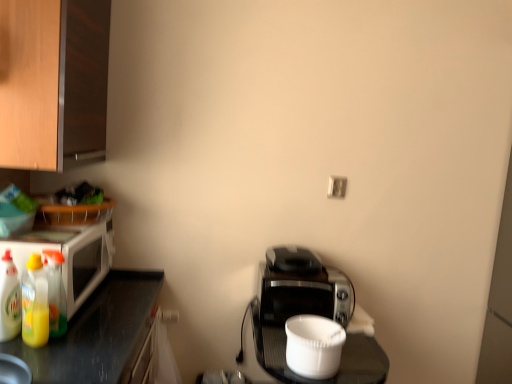
Measure the distance between white plastic container at center, acting as the 1th appliance starting from the front, and camera.

white plastic container at center, acting as the 1th appliance starting from the front, and camera are 1.40 meters apart.

What is the approximate height of black plastic toaster at center, the second appliance when ordered from front to back?

It is 8.12 inches.

In order to face wooden cabinet at upper left, should I rotate leftwards or rightwards?

You should look left and rotate roughly 26.152 degrees.

Where is `translucent plastic bottle at left, the third bottle from the right`? The width and height of the screenshot is (512, 384). translucent plastic bottle at left, the third bottle from the right is located at coordinates (x=9, y=298).

The height and width of the screenshot is (384, 512). Describe the element at coordinates (35, 303) in the screenshot. I see `yellow translucent bottle at left, which is the second bottle in left-to-right order` at that location.

Describe the element at coordinates (69, 255) in the screenshot. I see `white glossy microwave at left` at that location.

In order to click on white plastic container at center, which ranks as the 2th appliance in back-to-front order in this screenshot , I will do `click(314, 346)`.

From a real-world perspective, is translucent plastic bottle at left, the third bottle from the right, physically below white plastic electric outlet at upper center?

Yes, from a real-world perspective, translucent plastic bottle at left, the third bottle from the right, is beneath white plastic electric outlet at upper center.

You are a GUI agent. You are given a task and a screenshot of the screen. Output one action in this format:
    pyautogui.click(x=<x>, y=<y>)
    Task: Click on the 1st bottle below when counting from the white plastic electric outlet at upper center (from the image's perspective)
    
    Given the screenshot: What is the action you would take?
    pyautogui.click(x=9, y=298)

From the image's perspective, which one is positioned lower, translucent plastic bottle at left, the third bottle from the right, or white plastic electric outlet at upper center?

translucent plastic bottle at left, the third bottle from the right, is shown below in the image.

Between white glossy microwave at left and white plastic electric outlet at upper center, which one has smaller size?

With smaller size is white plastic electric outlet at upper center.

From the image's perspective, would you say white glossy microwave at left is shown under white plastic electric outlet at upper center?

Yes, from the image's perspective, white glossy microwave at left is below white plastic electric outlet at upper center.

Based on their positions, is white glossy microwave at left located to the left or right of white plastic electric outlet at upper center?

Based on their positions, white glossy microwave at left is located to the left of white plastic electric outlet at upper center.

Does white glossy microwave at left turn towards white plastic electric outlet at upper center?

Yes, white glossy microwave at left is aimed at white plastic electric outlet at upper center.

What's the angular difference between yellow translucent bottle at left, which is counted as the 2th bottle, starting from the right, and white plastic electric outlet at upper center's facing directions?

72.4 degrees separate the facing orientations of yellow translucent bottle at left, which is counted as the 2th bottle, starting from the right, and white plastic electric outlet at upper center.

Could you tell me if yellow translucent bottle at left, which is counted as the 2th bottle, starting from the right, is turned towards white plastic electric outlet at upper center?

No, yellow translucent bottle at left, which is counted as the 2th bottle, starting from the right, is not aimed at white plastic electric outlet at upper center.

Is yellow translucent bottle at left, which is counted as the 2th bottle, starting from the right, positioned in front of white plastic electric outlet at upper center?

Yes, the depth of yellow translucent bottle at left, which is counted as the 2th bottle, starting from the right, is less than that of white plastic electric outlet at upper center.

Can you confirm if yellow translucent bottle at left, which is the second bottle in left-to-right order, is bigger than white plastic electric outlet at upper center?

Yes.

Considering the sizes of white glossy microwave at left and translucent plastic bottle at left, marked as the first bottle in a left-to-right arrangement, in the image, is white glossy microwave at left bigger or smaller than translucent plastic bottle at left, marked as the first bottle in a left-to-right arrangement,?

In the image, white glossy microwave at left appears to be larger than translucent plastic bottle at left, marked as the first bottle in a left-to-right arrangement.

Could you tell me if white glossy microwave at left is facing translucent plastic bottle at left, marked as the first bottle in a left-to-right arrangement?

No.

Does white glossy microwave at left have a greater width compared to translucent plastic bottle at left, the third bottle from the right?

Yes, white glossy microwave at left is wider than translucent plastic bottle at left, the third bottle from the right.

Does wooden cabinet at upper left lie behind white plastic container at center, acting as the 1th appliance starting from the front?

That is False.

Which is closer to the camera, (90, 120) or (291, 369)?

The point (291, 369) is in front.

In the scene shown: Does translucent plastic bottle at left, marked as the first bottle in a left-to-right arrangement, touch white plastic container at center, acting as the 1th appliance starting from the front?

No, translucent plastic bottle at left, marked as the first bottle in a left-to-right arrangement, is not next to white plastic container at center, acting as the 1th appliance starting from the front.

Between translucent plastic bottle at left, marked as the first bottle in a left-to-right arrangement, and white plastic container at center, which ranks as the 2th appliance in back-to-front order, which one has larger size?

With larger size is white plastic container at center, which ranks as the 2th appliance in back-to-front order.

From the image's perspective, between translucent plastic bottle at left, marked as the first bottle in a left-to-right arrangement, and white plastic container at center, which ranks as the 2th appliance in back-to-front order, who is located below?

white plastic container at center, which ranks as the 2th appliance in back-to-front order, appears lower in the image.

Does point (4, 325) lie behind point (338, 336)?

No, (4, 325) is in front of (338, 336).

From a real-world perspective, which object stands above the other?

From a 3D spatial view, black plastic toaster at center, which is the first appliance from back to front, is above.

Can you tell me how much black plastic toaster at center, the second appliance when ordered from front to back, and white plastic container at center, acting as the 1th appliance starting from the front, differ in facing direction?

The angular difference between black plastic toaster at center, the second appliance when ordered from front to back, and white plastic container at center, acting as the 1th appliance starting from the front, is 2.38 degrees.

Is black plastic toaster at center, which is the first appliance from back to front, facing towards white plastic container at center, which ranks as the 2th appliance in back-to-front order?

Yes, black plastic toaster at center, which is the first appliance from back to front, is oriented towards white plastic container at center, which ranks as the 2th appliance in back-to-front order.

Where is `the 3rd bottle counting from the left of the white plastic electric outlet at upper center`? the 3rd bottle counting from the left of the white plastic electric outlet at upper center is located at coordinates (9, 298).

Where is `electric outlet on the right of white glossy microwave at left`? electric outlet on the right of white glossy microwave at left is located at coordinates (337, 187).

Estimate the real-world distances between objects in this image. Which object is closer to white glossy microwave at left, translucent plastic bottles at left, the 1th bottle when ordered from right to left, or translucent plastic bottle at left, marked as the first bottle in a left-to-right arrangement?

translucent plastic bottles at left, the 1th bottle when ordered from right to left, lies closer to white glossy microwave at left than the other object.

Considering their positions, is white plastic electric outlet at upper center positioned closer to black plastic toaster at center, which is the first appliance from back to front, than translucent plastic bottles at left, the 1th bottle when ordered from right to left?

Among the two, white plastic electric outlet at upper center is located nearer to black plastic toaster at center, which is the first appliance from back to front.

Based on their spatial positions, is yellow translucent bottle at left, which is counted as the 2th bottle, starting from the right, or black plastic toaster at center, which is the first appliance from back to front, closer to translucent plastic bottles at left, the 3th bottle from the left?

Based on the image, yellow translucent bottle at left, which is counted as the 2th bottle, starting from the right, appears to be nearer to translucent plastic bottles at left, the 3th bottle from the left.

Considering their positions, is white glossy microwave at left positioned closer to black plastic toaster at center, the second appliance when ordered from front to back, than translucent plastic bottle at left, the third bottle from the right?

The object closer to black plastic toaster at center, the second appliance when ordered from front to back, is white glossy microwave at left.

Based on the photo, based on their spatial positions, is translucent plastic bottle at left, marked as the first bottle in a left-to-right arrangement, or white plastic electric outlet at upper center further from white plastic container at center, which ranks as the 2th appliance in back-to-front order?

Among the two, translucent plastic bottle at left, marked as the first bottle in a left-to-right arrangement, is located further to white plastic container at center, which ranks as the 2th appliance in back-to-front order.

Estimate the real-world distances between objects in this image. Which object is further from black plastic toaster at center, which is the first appliance from back to front, yellow translucent bottle at left, which is counted as the 2th bottle, starting from the right, or translucent plastic bottle at left, the third bottle from the right?

translucent plastic bottle at left, the third bottle from the right.

From the image, which object appears to be nearer to black plastic toaster at center, the second appliance when ordered from front to back, white plastic container at center, which ranks as the 2th appliance in back-to-front order, or white plastic electric outlet at upper center?

white plastic container at center, which ranks as the 2th appliance in back-to-front order, is positioned closer to the anchor black plastic toaster at center, the second appliance when ordered from front to back.

Which object lies nearer to the anchor point yellow translucent bottle at left, which is the second bottle in left-to-right order, black plastic toaster at center, which is the first appliance from back to front, or translucent plastic bottle at left, the third bottle from the right?

translucent plastic bottle at left, the third bottle from the right.

Find the location of a particular element. The width and height of the screenshot is (512, 384). microwave oven between wooden cabinet at upper left and translucent plastic bottles at left, the 3th bottle from the left, from top to bottom is located at coordinates (69, 255).

Where is `appliance between translucent plastic bottles at left, the 1th bottle when ordered from right to left, and white plastic container at center, which ranks as the 2th appliance in back-to-front order, from left to right`? The height and width of the screenshot is (384, 512). appliance between translucent plastic bottles at left, the 1th bottle when ordered from right to left, and white plastic container at center, which ranks as the 2th appliance in back-to-front order, from left to right is located at coordinates 304,295.

I want to click on microwave oven between wooden cabinet at upper left and translucent plastic bottle at left, the third bottle from the right, in the up-down direction, so click(x=69, y=255).

Find the location of a particular element. Image resolution: width=512 pixels, height=384 pixels. appliance between yellow translucent bottle at left, which is the second bottle in left-to-right order, and white plastic container at center, acting as the 1th appliance starting from the front, in the horizontal direction is located at coordinates (304, 295).